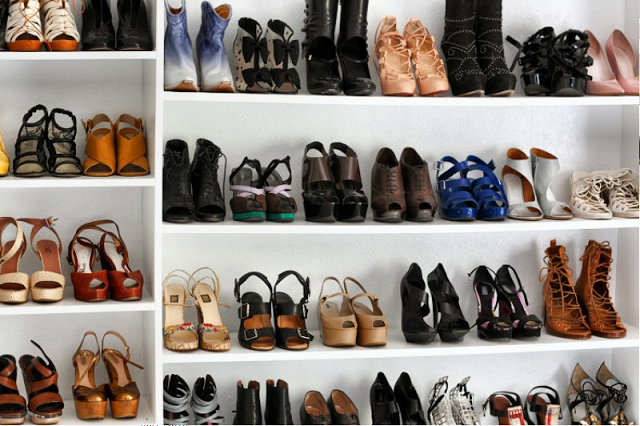
Where is `shelf`? This screenshot has width=640, height=426. shelf is located at coordinates (96, 51), (86, 190), (64, 312), (65, 417), (250, 95), (241, 234), (248, 360).